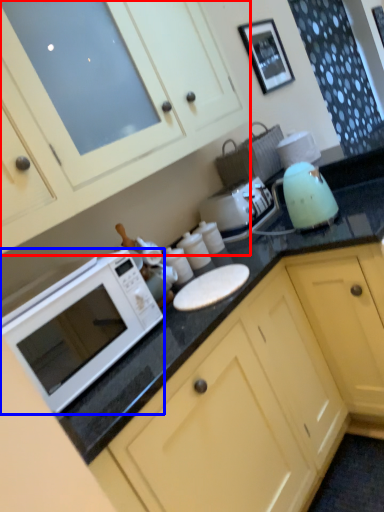
Question: Among these objects, which one is nearest to the camera, cabinetry (highlighted by a red box) or microwave oven (highlighted by a blue box)?

Choices:
 (A) cabinetry
 (B) microwave oven

Answer: (A)